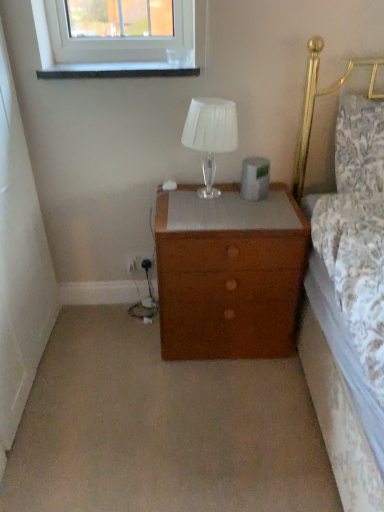
Question: Is granite-like stone window sill at upper left located within translucent glass table lamp at upper center?

Choices:
 (A) yes
 (B) no

Answer: (B)

Question: Would you say translucent glass table lamp at upper center is outside granite-like stone window sill at upper left?

Choices:
 (A) no
 (B) yes

Answer: (B)

Question: Is translucent glass table lamp at upper center not close to granite-like stone window sill at upper left?

Choices:
 (A) no
 (B) yes

Answer: (A)

Question: Considering the relative sizes of translucent glass table lamp at upper center and granite-like stone window sill at upper left in the image provided, is translucent glass table lamp at upper center shorter than granite-like stone window sill at upper left?

Choices:
 (A) yes
 (B) no

Answer: (B)

Question: Is translucent glass table lamp at upper center closer to camera compared to granite-like stone window sill at upper left?

Choices:
 (A) no
 (B) yes

Answer: (B)

Question: Can you confirm if translucent glass table lamp at upper center is wider than granite-like stone window sill at upper left?

Choices:
 (A) no
 (B) yes

Answer: (A)

Question: Is wooden nightstand at center bigger than floral fabric pillow at right?

Choices:
 (A) yes
 (B) no

Answer: (A)

Question: Is there a large distance between wooden nightstand at center and floral fabric pillow at right?

Choices:
 (A) no
 (B) yes

Answer: (A)

Question: Can you confirm if wooden nightstand at center is smaller than floral fabric pillow at right?

Choices:
 (A) no
 (B) yes

Answer: (A)

Question: Can you confirm if wooden nightstand at center is positioned to the right of floral fabric pillow at right?

Choices:
 (A) yes
 (B) no

Answer: (B)

Question: From the image's perspective, does wooden nightstand at center appear lower than floral fabric pillow at right?

Choices:
 (A) no
 (B) yes

Answer: (B)

Question: From a real-world perspective, is wooden nightstand at center on floral fabric pillow at right?

Choices:
 (A) yes
 (B) no

Answer: (B)

Question: Is wooden nightstand at center surrounded by floral fabric pillow at right?

Choices:
 (A) yes
 (B) no

Answer: (B)